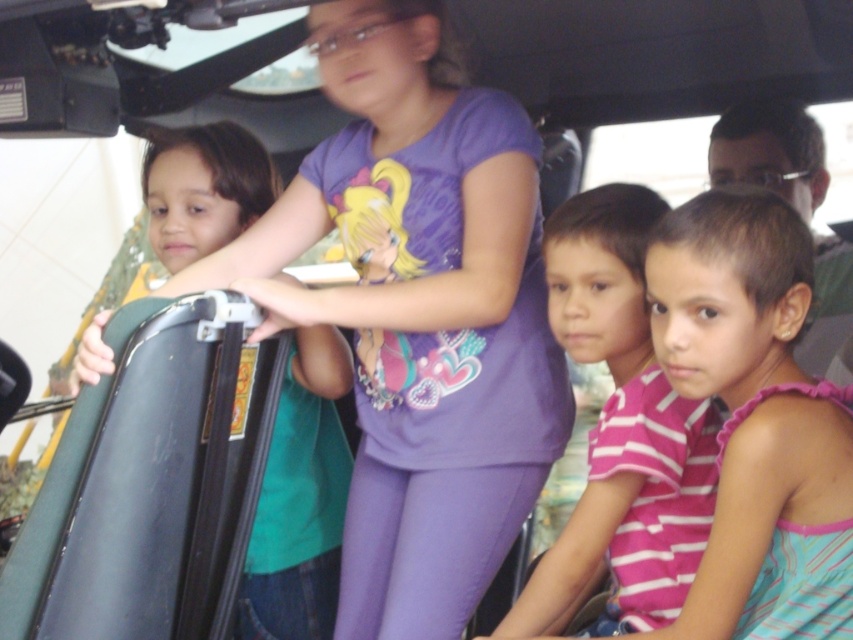
You are a tour guide on a military base. You see a child wearing a pink striped shirt at center and a green matte suitcase at left. Which object is closer to the front of the vehicle?

The pink striped shirt at center is positioned under the green matte suitcase at left, meaning the green matte suitcase at left is closer to the front of the vehicle.

You are a tour guide standing 2 meters away from the point at coordinates point (219, 596). Can you safely approach the point without moving too close to the children?

The distance of point (219, 596) from viewer is 1.55 meters, so if you are standing 2 meters away, you can safely approach the point as you are already farther than the point itself. However, ensure not to disturb the children.